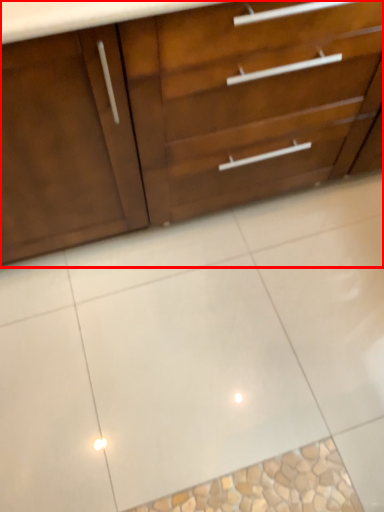
Question: From the image's perspective, considering the relative positions of chest of drawers (annotated by the red box) and ceramic tile in the image provided, where is chest of drawers (annotated by the red box) located with respect to the staircase?

Choices:
 (A) above
 (B) below

Answer: (A)